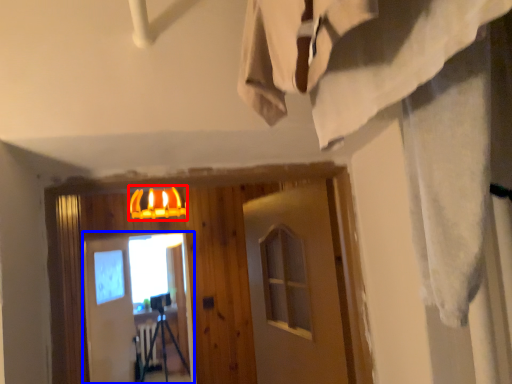
Question: Among these objects, which one is nearest to the camera, lamp (highlighted by a red box) or screen door (highlighted by a blue box)?

Choices:
 (A) lamp
 (B) screen door

Answer: (A)